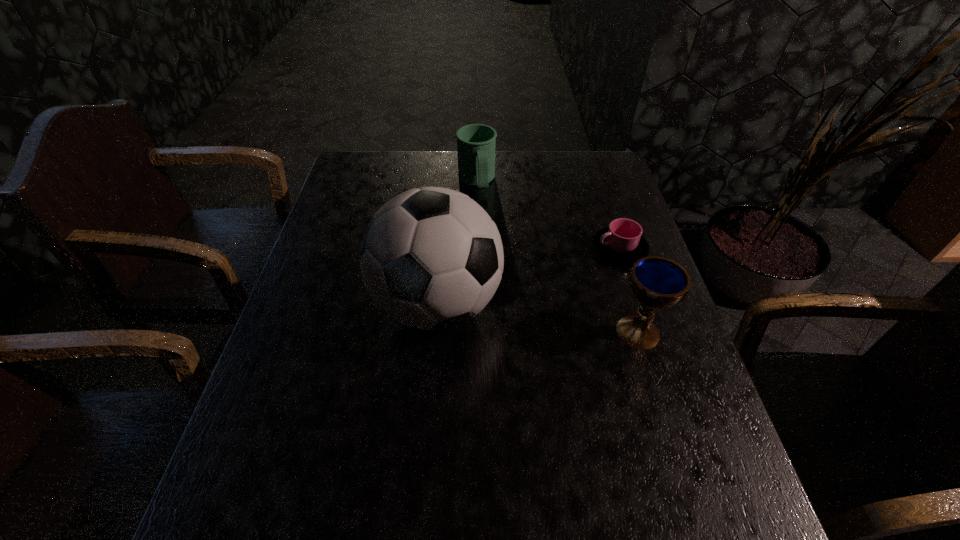
Find the location of a particular element. the tallest object is located at coordinates (431, 258).

Locate an element on the screen. The width and height of the screenshot is (960, 540). chalice is located at coordinates (657, 283).

This screenshot has width=960, height=540. What are the coordinates of `the third tallest object` in the screenshot? It's located at (476, 143).

Locate an element on the screen. The image size is (960, 540). mug is located at coordinates (476, 143).

Identify the location of the shortest object. Image resolution: width=960 pixels, height=540 pixels. (622, 242).

Find the location of a particular element. vacant space located 0.250m on the right of the tallest object is located at coordinates (604, 305).

You are a GUI agent. You are given a task and a screenshot of the screen. Output one action in this format:
    pyautogui.click(x=<x>, y=<y>)
    Task: Click on the free spot located 0.160m on the left of the second tallest object
    Image resolution: width=960 pixels, height=540 pixels.
    Given the screenshot: What is the action you would take?
    pyautogui.click(x=544, y=332)

The width and height of the screenshot is (960, 540). I want to click on blank area located 0.160m on the side of the third tallest object with the handle, so click(491, 231).

You are a GUI agent. You are given a task and a screenshot of the screen. Output one action in this format:
    pyautogui.click(x=<x>, y=<y>)
    Task: Click on the free space located on the side of the third tallest object with the handle
    The height and width of the screenshot is (540, 960).
    Given the screenshot: What is the action you would take?
    pyautogui.click(x=502, y=269)

Find the location of `vacant space located on the side of the third tallest object with the handle`. vacant space located on the side of the third tallest object with the handle is located at coordinates (484, 212).